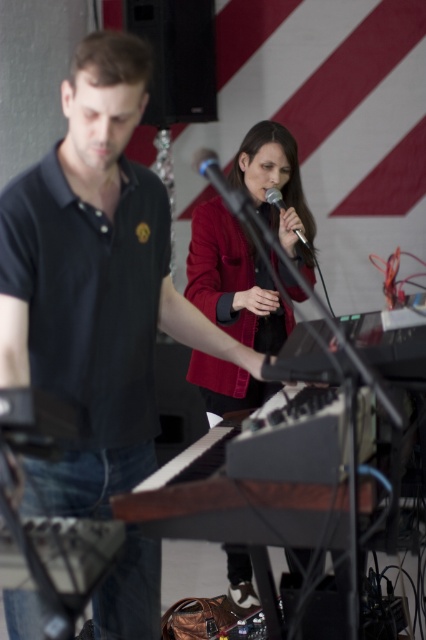
Which of these two, black matte shirt at left or matte red jacket at center, stands taller?

black matte shirt at left is taller.

Is black matte shirt at left closer to camera compared to matte red jacket at center?

Yes, it is in front of matte red jacket at center.

Is point (78, 400) more distant than point (252, 150)?

No, it is not.

At what (x,y) coordinates should I click in order to perform the action: click on black matte shirt at left. Please return your answer as a coordinate pair (x, y). Image resolution: width=426 pixels, height=640 pixels. Looking at the image, I should click on (95, 284).

Consider the image. Is metallic blue microphone at center taller than silver metallic microphone at center?

Correct, metallic blue microphone at center is much taller as silver metallic microphone at center.

Does point (204, 164) come closer to viewer compared to point (281, 196)?

Yes, it is in front of point (281, 196).

I want to click on metallic blue microphone at center, so click(x=212, y=172).

Does matte red jacket at center have a lesser width compared to metallic blue microphone at center?

No, matte red jacket at center is not thinner than metallic blue microphone at center.

Who is higher up, matte red jacket at center or metallic blue microphone at center?

metallic blue microphone at center is higher up.

This screenshot has width=426, height=640. What are the coordinates of `matte red jacket at center` in the screenshot? It's located at (233, 280).

Where is `matte red jacket at center`? The height and width of the screenshot is (640, 426). matte red jacket at center is located at coordinates (233, 280).